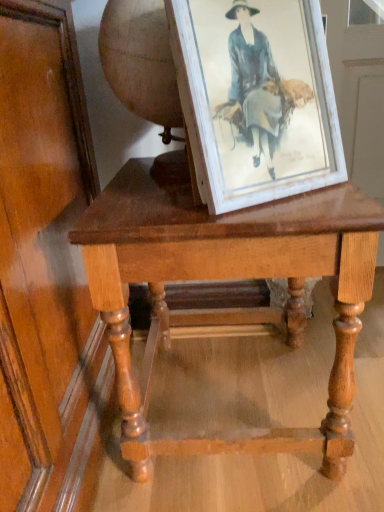
Question: Is white distressed wood picture frame at center touching light brown wooden table at center?

Choices:
 (A) yes
 (B) no

Answer: (B)

Question: Is white distressed wood picture frame at center smaller than light brown wooden table at center?

Choices:
 (A) yes
 (B) no

Answer: (A)

Question: Could you tell me if white distressed wood picture frame at center is turned towards light brown wooden table at center?

Choices:
 (A) yes
 (B) no

Answer: (B)

Question: From a real-world perspective, is white distressed wood picture frame at center physically below light brown wooden table at center?

Choices:
 (A) yes
 (B) no

Answer: (B)

Question: Is white distressed wood picture frame at center wider than light brown wooden table at center?

Choices:
 (A) no
 (B) yes

Answer: (A)

Question: Is white distressed wood picture frame at center bigger than light brown wooden table at center?

Choices:
 (A) no
 (B) yes

Answer: (A)

Question: Would you say light brown wooden table at center is a long distance from white distressed wood picture frame at center?

Choices:
 (A) no
 (B) yes

Answer: (A)

Question: From a real-world perspective, is light brown wooden table at center located beneath white distressed wood picture frame at center?

Choices:
 (A) yes
 (B) no

Answer: (A)

Question: Does light brown wooden table at center have a greater height compared to white distressed wood picture frame at center?

Choices:
 (A) yes
 (B) no

Answer: (A)

Question: Considering the relative sizes of light brown wooden table at center and white distressed wood picture frame at center in the image provided, is light brown wooden table at center wider than white distressed wood picture frame at center?

Choices:
 (A) no
 (B) yes

Answer: (B)

Question: Can you confirm if light brown wooden table at center is smaller than white distressed wood picture frame at center?

Choices:
 (A) yes
 (B) no

Answer: (B)

Question: Is white distressed wood picture frame at center surrounded by light brown wooden table at center?

Choices:
 (A) yes
 (B) no

Answer: (B)

Question: Based on their positions, is light brown wooden table at center located to the left or right of white distressed wood picture frame at center?

Choices:
 (A) left
 (B) right

Answer: (A)